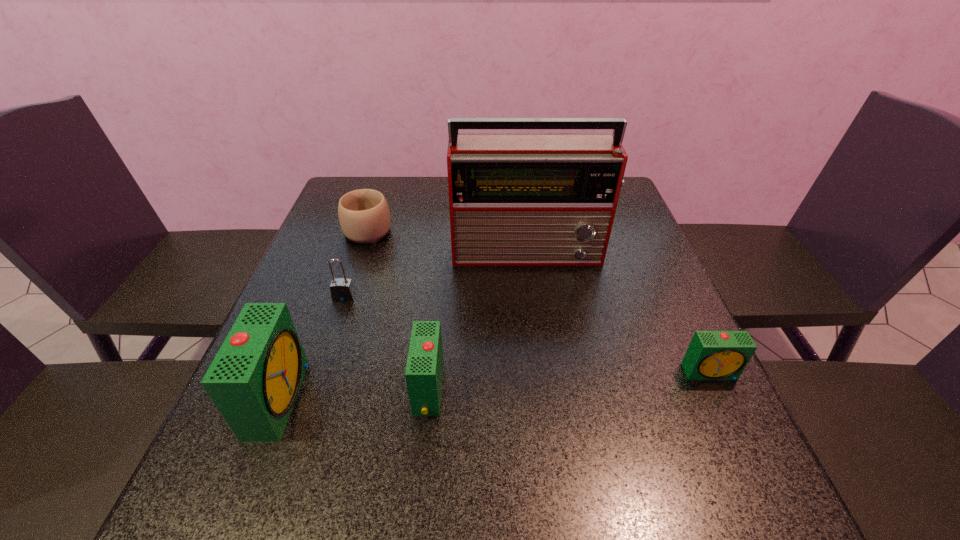
What are the coordinates of `vacant space at the left edge` in the screenshot? It's located at 303,306.

In the image, there is a desktop. At what (x,y) coordinates should I click in order to perform the action: click on vacant space at the right edge. Please return your answer as a coordinate pair (x, y). This screenshot has width=960, height=540. Looking at the image, I should click on (634, 237).

Identify the location of vacant space at the far left corner. (342, 180).

The image size is (960, 540). In order to click on vacant space at the near left corner of the desktop in this screenshot , I will do point(219,435).

At what (x,y) coordinates should I click in order to perform the action: click on free space at the near right corner of the desktop. Please return your answer as a coordinate pair (x, y). Looking at the image, I should click on (698, 445).

You are a GUI agent. You are given a task and a screenshot of the screen. Output one action in this format:
    pyautogui.click(x=<x>, y=<y>)
    Task: Click on the free space between the fifth shortest object and the fourth nearest object
    The width and height of the screenshot is (960, 540).
    Given the screenshot: What is the action you would take?
    pyautogui.click(x=312, y=348)

Identify the location of vacant region between the second tallest object and the second tallest alarm clock. Image resolution: width=960 pixels, height=540 pixels. (353, 394).

Image resolution: width=960 pixels, height=540 pixels. Find the location of `vacant area that lies between the shortest alarm clock and the second tallest alarm clock`. vacant area that lies between the shortest alarm clock and the second tallest alarm clock is located at coordinates (569, 381).

This screenshot has width=960, height=540. I want to click on vacant space that's between the shortest alarm clock and the radio receiver, so (x=620, y=312).

The image size is (960, 540). What are the coordinates of `free area in between the padlock and the tallest alarm clock` in the screenshot? It's located at (312, 348).